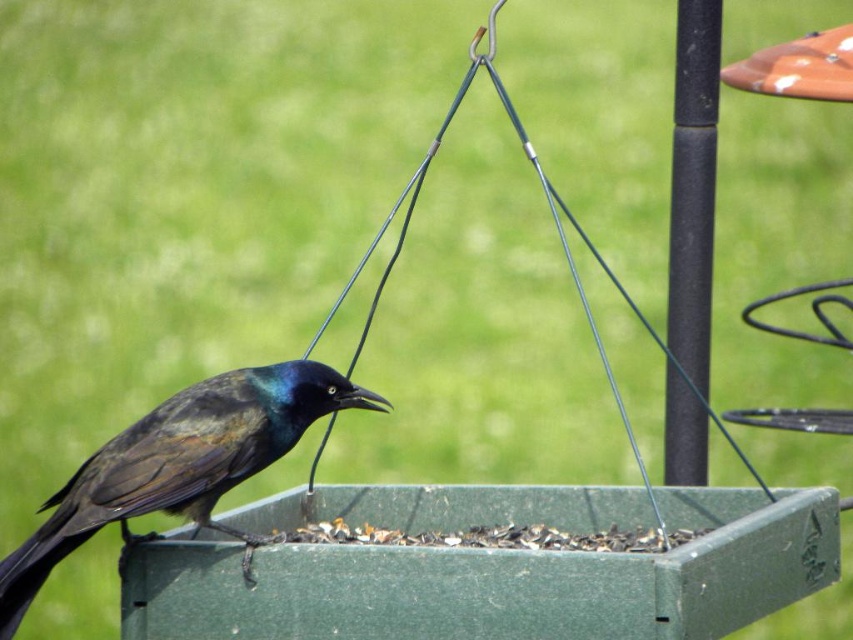
You are standing in a garden and see a bird feeder with a blackbird. The bird is at point (180, 465). If you want to place a new feeder 0.1 units to the right of the current bird, where would you place it?

The new feeder should be placed at point 0.827, 0.212, which is 0.1 units to the right of the shiny black bird at center located at (180, 465).

You are standing at the point labeled point (189, 496) and want to take a photo of the bird feeder. The camera you have is 7.07 feet away from the point. Is the camera close enough to capture the bird feeder in focus?

The point (189, 496) and camera are 7.07 feet apart from each other. Since the camera is exactly at the required distance, it should be able to capture the bird feeder in focus.

You are standing in a garden and see the shiny black bird at center. If you want to observe it closely without disturbing it, what is the minimum distance you should maintain?

The minimum distance you should maintain is 2.04 meters to avoid disturbing the shiny black bird at center.